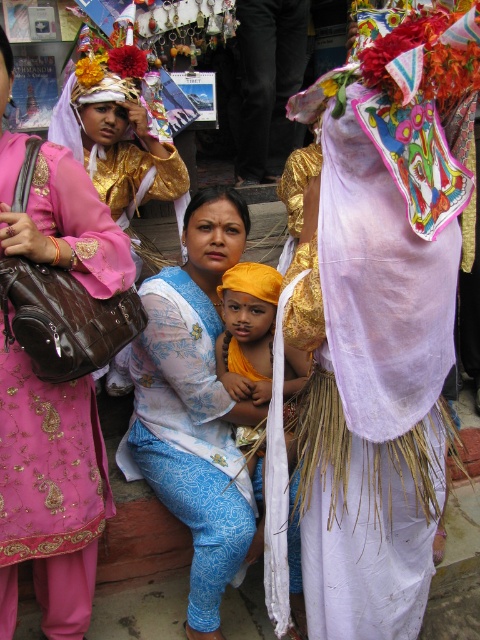
Question: Can you confirm if matte pink dress at left is positioned above blue printed fabric at center?

Choices:
 (A) yes
 (B) no

Answer: (B)

Question: Among these points, which one is nearest to the camera?

Choices:
 (A) (231, 504)
 (B) (21, 138)
 (C) (396, 364)

Answer: (C)

Question: Which object is farther from the camera taking this photo?

Choices:
 (A) blue printed fabric at center
 (B) matte pink dress at left
 (C) white sheer cloth at center

Answer: (A)

Question: Is white sheer cloth at center thinner than matte pink dress at left?

Choices:
 (A) yes
 (B) no

Answer: (B)

Question: Which is farther from the white sheer cloth at center?

Choices:
 (A) matte pink dress at left
 (B) blue printed fabric at center

Answer: (A)

Question: Observing the image, what is the correct spatial positioning of white sheer cloth at center in reference to matte pink dress at left?

Choices:
 (A) above
 (B) below

Answer: (A)